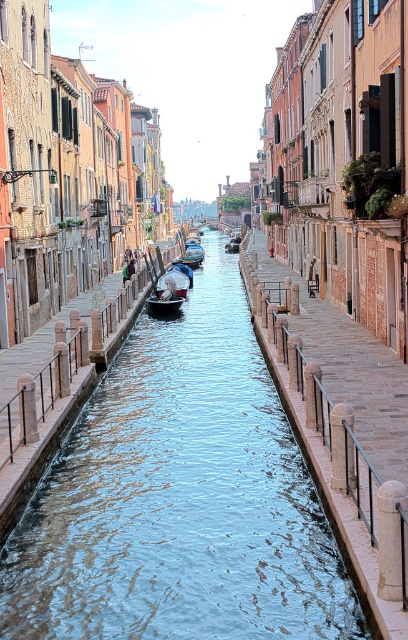
Based on the scene description, what is the color of the water at the point marked by coordinates (x=179, y=497)?

The clear blue water at center is marked by the point (x=179, y=497), so the color is clear blue.

You are standing on a bridge overlooking the canal and want to take a photo of the clear blue water at center and the wooden gondola at center. If your camera has a zoom lens that can focus up to 50 meters, will you be able to capture both objects clearly in the same photo?

The clear blue water at center is 50.46 meters away from the wooden gondola at center. Since the camera can focus up to 50 meters, the distance between them exceeds the maximum focus range. Therefore, you might not be able to capture both objects clearly in the same photo.